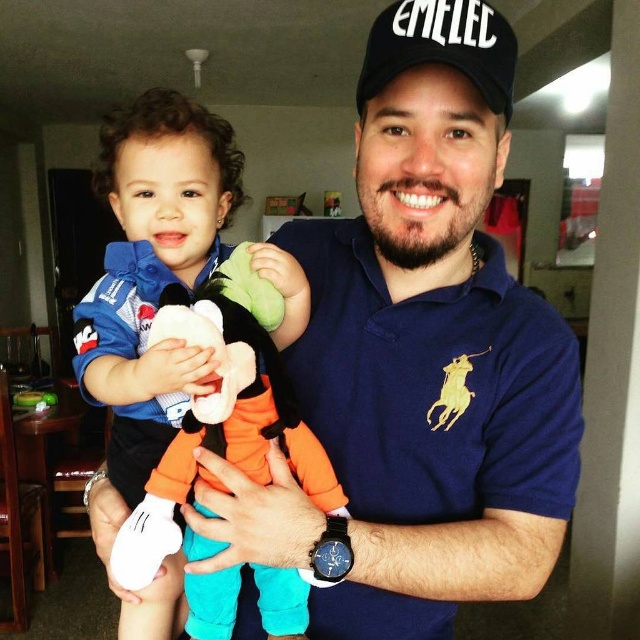
You are a guest in this home and want to place a small gift on the table where the soft plush toy at center is located. However, you notice the black fabric cap at upper center is already there. Can you place your gift between them without moving either item?

The soft plush toy at center is located below the black fabric cap at upper center, so there is vertical space between them. You can place your gift between them by positioning it horizontally between the two items since they are vertically aligned.

You are organizing a birthday party and need to place decorations around the room. The soft plush toy at center is currently at point 0.433, 0.237. Where should you place a new balloon arrangement so it doesn,t interfere with the plush toy?

The soft plush toy at center is located at point (150,276). To avoid interference, place the balloon arrangement at a different coordinate, such as (320,320) or (256,192).

You are a photographer taking a picture of the scene. You want to ensure both the soft plush toy at center and the black fabric cap at upper center are clearly visible. Which object should you adjust your focus to first to capture both in the frame?

The soft plush toy at center is positioned on the left side of black fabric cap at upper center, so you should focus on the black fabric cap at upper center first since it is closer to the camera and then adjust to include the soft plush toy at center in the frame.